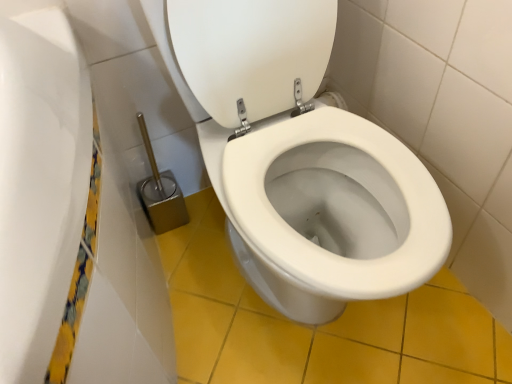
The image size is (512, 384). What do you see at coordinates (298, 159) in the screenshot?
I see `white glossy toilet at center` at bounding box center [298, 159].

At what (x,y) coordinates should I click in order to perform the action: click on white glossy toilet at center. Please return your answer as a coordinate pair (x, y). The image size is (512, 384). Looking at the image, I should click on (298, 159).

Locate an element on the screen. This screenshot has width=512, height=384. white glossy toilet at center is located at coordinates (298, 159).